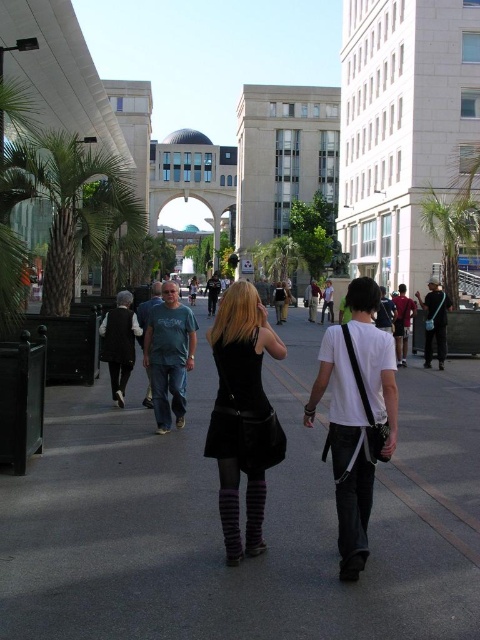
Question: Estimate the real-world distances between objects in this image. Which object is closer to the smooth asphalt pavement at center?

Choices:
 (A) green leafy palm tree at right
 (B) green leafy palm tree at left

Answer: (B)

Question: Does green leafy palm tree at left have a smaller size compared to green leafy palm tree at right?

Choices:
 (A) no
 (B) yes

Answer: (A)

Question: Is smooth asphalt pavement at center to the right of green leafy palm tree at left from the viewer's perspective?

Choices:
 (A) yes
 (B) no

Answer: (A)

Question: Which of these objects is positioned farthest from the smooth asphalt pavement at center?

Choices:
 (A) green leafy palm tree at left
 (B) black leather skirt at center
 (C) green leafy palm tree at right

Answer: (C)

Question: Which object is the farthest from the black leather skirt at center?

Choices:
 (A) smooth asphalt pavement at center
 (B) green leafy palm tree at left
 (C) green leafy palm tree at right

Answer: (C)

Question: In this image, where is black leather skirt at center located relative to green leafy palm tree at left?

Choices:
 (A) right
 (B) left

Answer: (A)